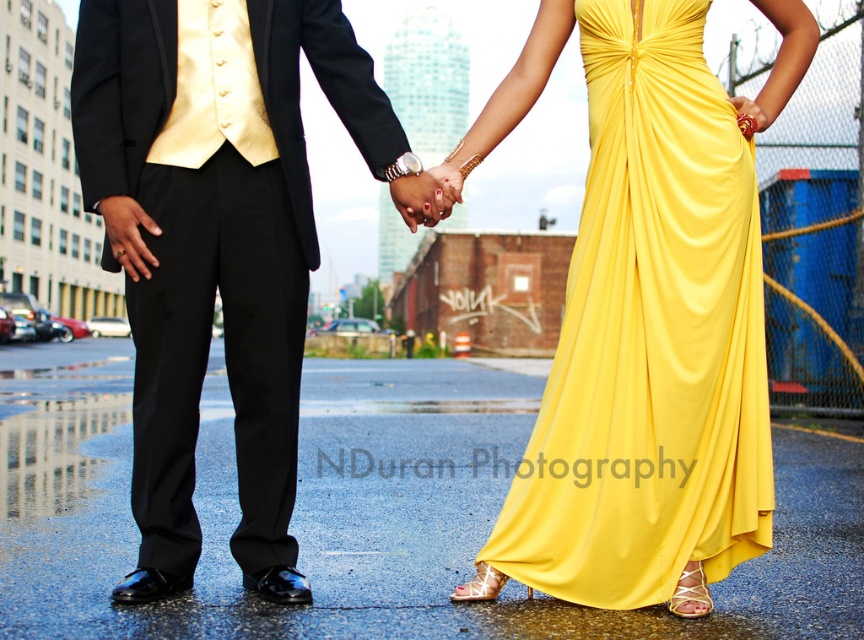
Between satin yellow dress at center and shiny black suit at center, which one is positioned higher?

shiny black suit at center is above.

I want to click on satin yellow dress at center, so click(649, 340).

Locate an element on the screen. This screenshot has width=864, height=640. satin yellow dress at center is located at coordinates (649, 340).